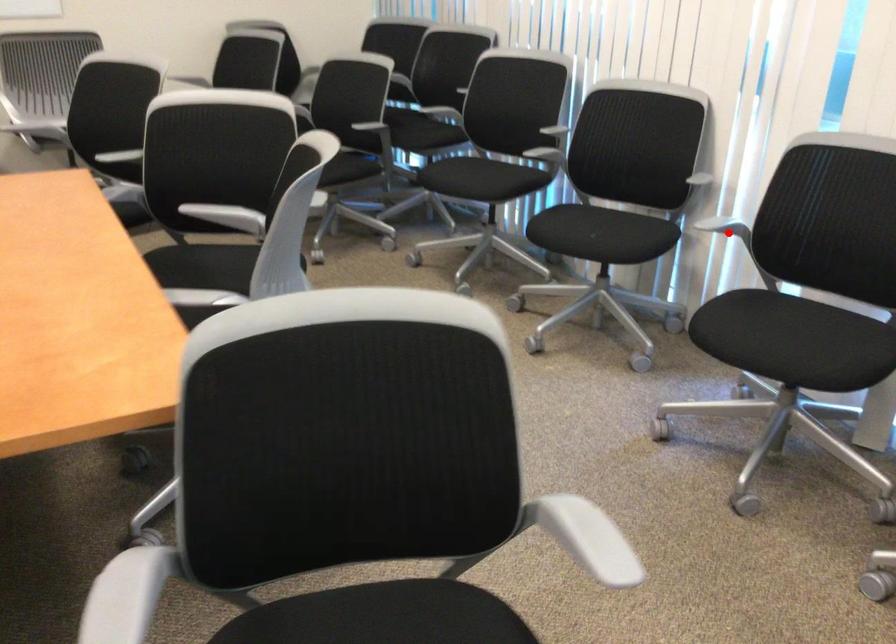
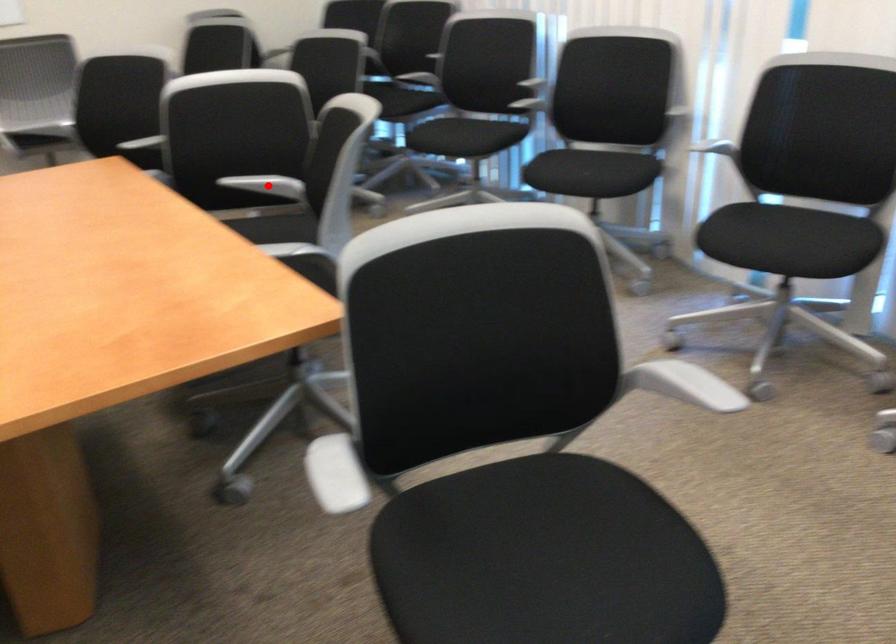
I am providing you with two images of the same scene from different viewpoints. A red point is marked on the first image and another point is marked on the second image. Does the point marked in image1 correspond to the same location as the one in image2?

No